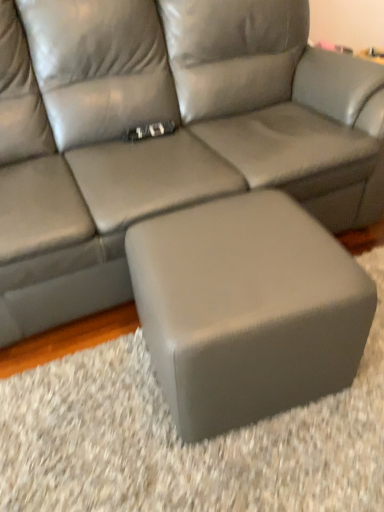
The height and width of the screenshot is (512, 384). What are the coordinates of `matte gray ottoman at center` in the screenshot? It's located at (246, 309).

What do you see at coordinates (246, 309) in the screenshot? I see `matte gray ottoman at center` at bounding box center [246, 309].

Where is `matte gray leather couch at center`? Image resolution: width=384 pixels, height=512 pixels. matte gray leather couch at center is located at coordinates (164, 136).

What is the approximate width of matte gray leather couch at center?

matte gray leather couch at center is 38.48 inches wide.

What do you see at coordinates (164, 136) in the screenshot?
I see `matte gray leather couch at center` at bounding box center [164, 136].

Measure the distance between point (232, 2) and camera.

Point (232, 2) and camera are 1.65 meters apart.

You are a GUI agent. You are given a task and a screenshot of the screen. Output one action in this format:
    pyautogui.click(x=<x>, y=<y>)
    Task: Click on the matte gray ottoman at center
    The height and width of the screenshot is (512, 384).
    Given the screenshot: What is the action you would take?
    pyautogui.click(x=246, y=309)

Is matte gray leather couch at center to the left or to the right of matte gray ottoman at center in the image?

From the image, it's evident that matte gray leather couch at center is to the left of matte gray ottoman at center.

Based on the photo, in the image, is matte gray leather couch at center positioned in front of or behind matte gray ottoman at center?

matte gray leather couch at center is in front of matte gray ottoman at center.

Considering the positions of points (190, 190) and (207, 334), is point (190, 190) closer to camera compared to point (207, 334)?

No, (190, 190) is further to viewer.

From the image's perspective, between matte gray leather couch at center and matte gray ottoman at center, who is located below?

matte gray ottoman at center.

From a real-world perspective, between matte gray leather couch at center and matte gray ottoman at center, who is vertically higher?

matte gray leather couch at center.

Is matte gray leather couch at center wider than matte gray ottoman at center?

Indeed, matte gray leather couch at center has a greater width compared to matte gray ottoman at center.

Which of these two, matte gray leather couch at center or matte gray ottoman at center, stands taller?

Standing taller between the two is matte gray leather couch at center.

Between matte gray leather couch at center and matte gray ottoman at center, which one has smaller size?

matte gray ottoman at center is smaller.

Is matte gray ottoman at center inside matte gray leather couch at center?

Actually, matte gray ottoman at center is outside matte gray leather couch at center.

Are matte gray leather couch at center and matte gray ottoman at center beside each other?

No.

Is matte gray ottoman at center at the back of matte gray leather couch at center?

matte gray leather couch at center does not have its back to matte gray ottoman at center.

Locate an element on the screen. studio couch in front of the matte gray ottoman at center is located at coordinates (164, 136).

Is matte gray ottoman at center at the right side of matte gray leather couch at center?

Yes, matte gray ottoman at center is to the right of matte gray leather couch at center.

Relative to matte gray leather couch at center, is matte gray ottoman at center in front or behind?

matte gray ottoman at center is behind matte gray leather couch at center.

Which point is more forward, (191, 243) or (6, 213)?

The point (191, 243) is more forward.

From the image's perspective, does matte gray ottoman at center appear higher than matte gray leather couch at center?

Actually, matte gray ottoman at center appears below matte gray leather couch at center in the image.

From a real-world perspective, is matte gray ottoman at center positioned above or below matte gray leather couch at center?

From a real-world perspective, matte gray ottoman at center is physically below matte gray leather couch at center.

Which object is wider, matte gray ottoman at center or matte gray leather couch at center?

With larger width is matte gray leather couch at center.

Between matte gray ottoman at center and matte gray leather couch at center, which one has less height?

matte gray ottoman at center is shorter.

Is matte gray ottoman at center bigger or smaller than matte gray leather couch at center?

Clearly, matte gray ottoman at center is smaller in size than matte gray leather couch at center.

Is matte gray leather couch at center located within matte gray ottoman at center?

No, matte gray leather couch at center is not a part of matte gray ottoman at center.

Is matte gray ottoman at center in contact with matte gray leather couch at center?

There is a gap between matte gray ottoman at center and matte gray leather couch at center.

Does matte gray ottoman at center turn towards matte gray leather couch at center?

No, matte gray ottoman at center is not aimed at matte gray leather couch at center.

Can you tell me how much matte gray ottoman at center and matte gray leather couch at center differ in facing direction?

3.13 degrees.

You are a GUI agent. You are given a task and a screenshot of the screen. Output one action in this format:
    pyautogui.click(x=<x>, y=<y>)
    Task: Click on the stool behind the matte gray leather couch at center
    This screenshot has height=512, width=384.
    Given the screenshot: What is the action you would take?
    pyautogui.click(x=246, y=309)

The height and width of the screenshot is (512, 384). Find the location of `stool that appears behind the matte gray leather couch at center`. stool that appears behind the matte gray leather couch at center is located at coordinates (246, 309).

There is a matte gray ottoman at center. Identify the location of studio couch above it (from a real-world perspective). (164, 136).